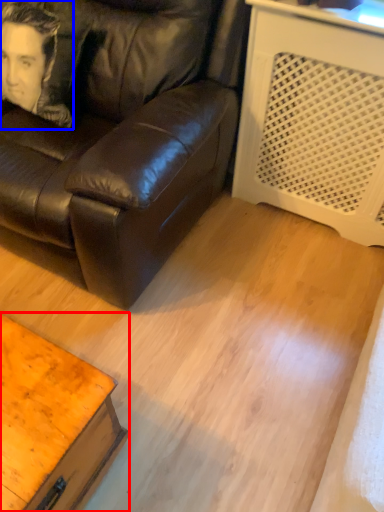
Question: Which point is further to the camera, table (highlighted by a red box) or man (highlighted by a blue box)?

Choices:
 (A) table
 (B) man

Answer: (B)